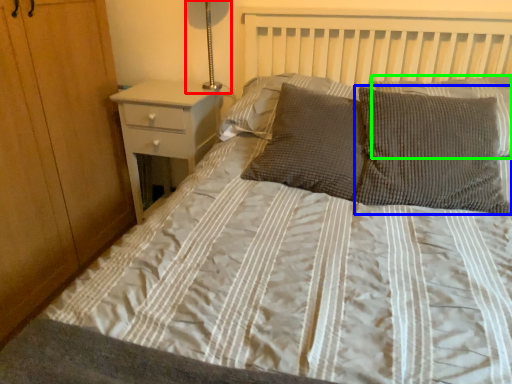
Question: Which is farther away from bedside lamp (highlighted by a red box)? pillow (highlighted by a blue box) or pillow (highlighted by a green box)?

Choices:
 (A) pillow
 (B) pillow

Answer: (A)